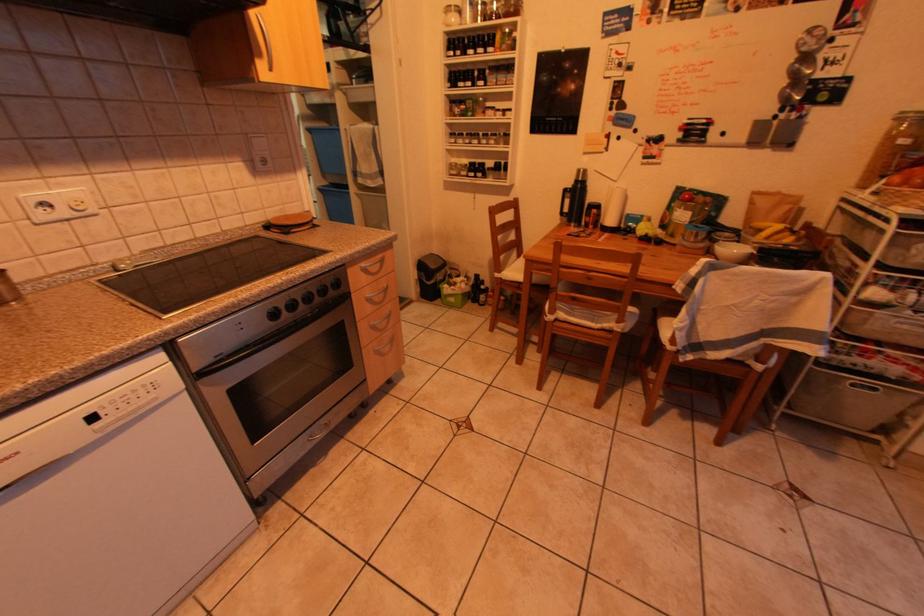
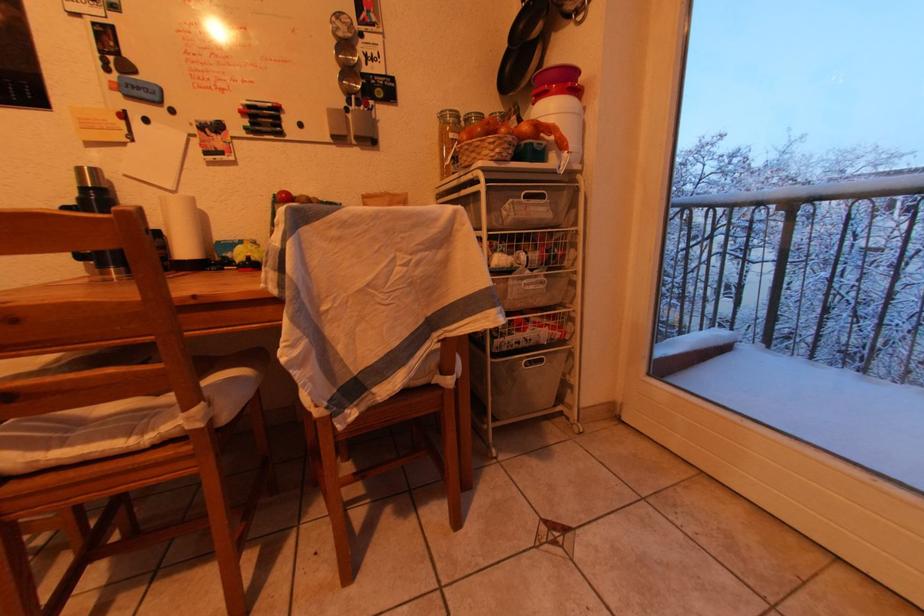
Question: The camera is either moving clockwise (left) or counter-clockwise (right) around the object. The first image is from the beginning of the video and the second image is from the end. Is the camera moving left or right when shooting the video?

Choices:
 (A) Left
 (B) Right

Answer: (A)